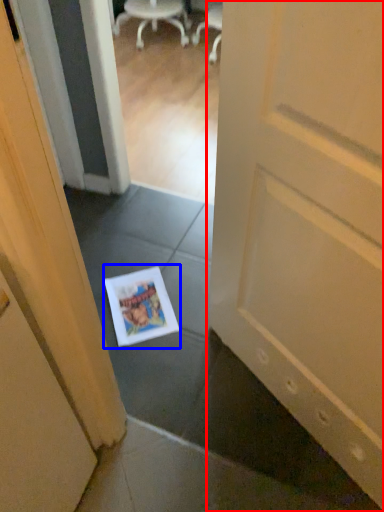
Question: Which point is closer to the camera, door (highlighted by a red box) or magazine (highlighted by a blue box)?

Choices:
 (A) door
 (B) magazine

Answer: (A)